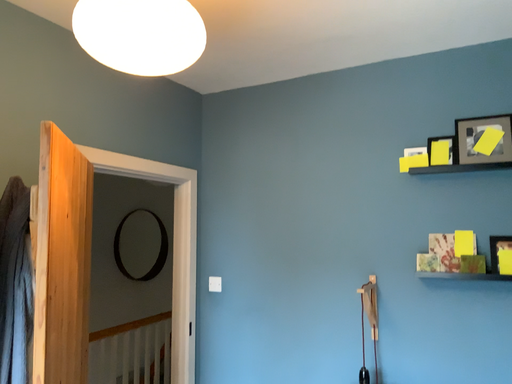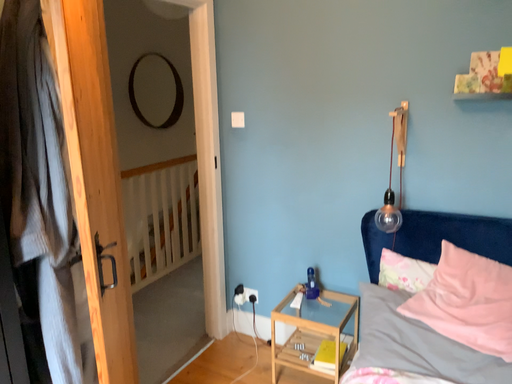
Question: How did the camera likely rotate when shooting the video?

Choices:
 (A) rotated downward
 (B) rotated upward

Answer: (A)